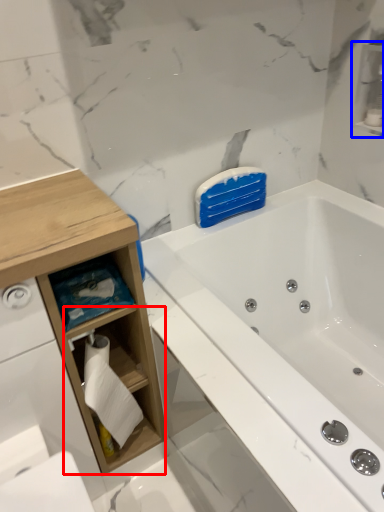
Question: Which point is further to the camera, cabinet (highlighted by a red box) or cabinet (highlighted by a blue box)?

Choices:
 (A) cabinet
 (B) cabinet

Answer: (B)